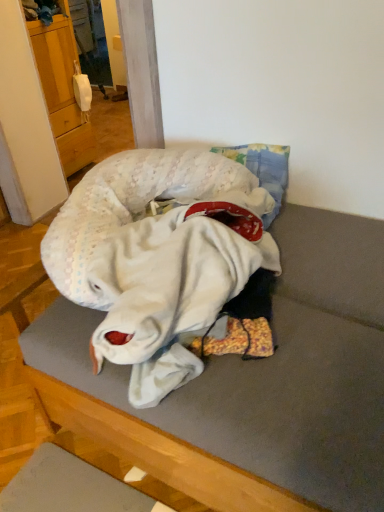
Question: Is wooden cabinet at left bigger than white knitted baby at center?

Choices:
 (A) no
 (B) yes

Answer: (A)

Question: Is wooden cabinet at left to the right of white knitted baby at center from the viewer's perspective?

Choices:
 (A) no
 (B) yes

Answer: (A)

Question: Is wooden cabinet at left positioned before white knitted baby at center?

Choices:
 (A) no
 (B) yes

Answer: (A)

Question: Is wooden cabinet at left not within white knitted baby at center?

Choices:
 (A) yes
 (B) no

Answer: (A)

Question: Does wooden cabinet at left appear on the left side of white knitted baby at center?

Choices:
 (A) yes
 (B) no

Answer: (A)

Question: Looking at their shapes, would you say white fabric pillow at center is wider or thinner than white knitted baby at center?

Choices:
 (A) wide
 (B) thin

Answer: (A)

Question: From a real-world perspective, is white fabric pillow at center above or below white knitted baby at center?

Choices:
 (A) above
 (B) below

Answer: (B)

Question: Based on their sizes in the image, would you say white fabric pillow at center is bigger or smaller than white knitted baby at center?

Choices:
 (A) big
 (B) small

Answer: (A)

Question: Would you say white fabric pillow at center is to the left or to the right of white knitted baby at center in the picture?

Choices:
 (A) left
 (B) right

Answer: (B)

Question: Is point (84, 141) positioned closer to the camera than point (304, 332)?

Choices:
 (A) farther
 (B) closer

Answer: (A)

Question: From a real-world perspective, relative to white fabric pillow at center, is wooden cabinet at left vertically above or below?

Choices:
 (A) above
 (B) below

Answer: (A)

Question: From the image's perspective, relative to white fabric pillow at center, is wooden cabinet at left above or below?

Choices:
 (A) above
 (B) below

Answer: (A)

Question: In terms of width, does wooden cabinet at left look wider or thinner when compared to white fabric pillow at center?

Choices:
 (A) wide
 (B) thin

Answer: (B)

Question: Is white knitted baby at center in front of or behind white fabric pillow at center in the image?

Choices:
 (A) behind
 (B) front

Answer: (A)

Question: Choose the correct answer: Is white knitted baby at center inside white fabric pillow at center or outside it?

Choices:
 (A) inside
 (B) outside

Answer: (A)